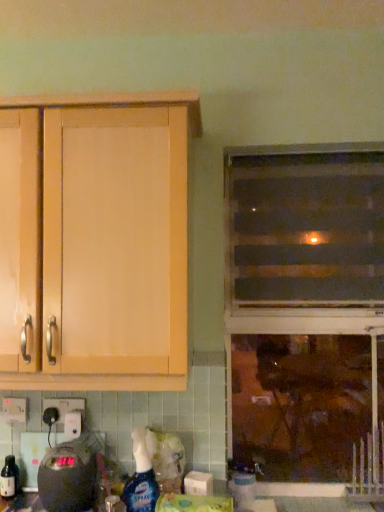
Question: From the image's perspective, relative to translucent plastic screen door at upper right, is translucent plastic spray bottle at lower center above or below?

Choices:
 (A) above
 (B) below

Answer: (B)

Question: Does point (155, 444) appear closer or farther from the camera than point (362, 263)?

Choices:
 (A) closer
 (B) farther

Answer: (A)

Question: Considering the real-world distances, which object is farthest from the black plastic scale at lower left?

Choices:
 (A) translucent plastic screen door at upper right
 (B) white plastic electric outlet at lower left
 (C) transparent glass window at center
 (D) light wood cabinet at upper left
 (E) matte black spray bottle at lower left

Answer: (A)

Question: Which of these objects is positioned farthest from the white plastic electric outlet at lower left?

Choices:
 (A) black plastic scale at lower left
 (B) translucent plastic spray bottle at lower center
 (C) transparent glass window at center
 (D) matte black spray bottle at lower left
 (E) light wood cabinet at upper left

Answer: (C)